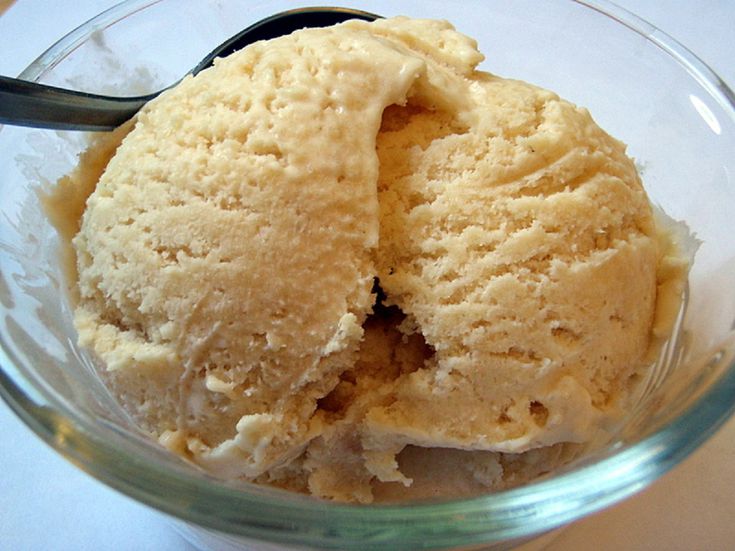
This screenshot has height=551, width=735. I want to click on spoon, so click(104, 117).